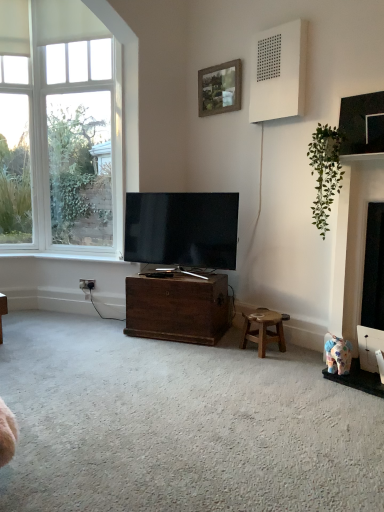
What is the approximate width of dark brown wood chest at center?

21.63 inches.

Describe the element at coordinates (338, 355) in the screenshot. I see `fluffy fabric elephant at lower right` at that location.

This screenshot has height=512, width=384. Identify the location of wooden frame at upper center. (219, 88).

Where is `clear glass window at left`? This screenshot has height=512, width=384. clear glass window at left is located at coordinates (66, 128).

Locate an element on the screen. The image size is (384, 512). dark brown wood chest at center is located at coordinates (178, 308).

The height and width of the screenshot is (512, 384). I want to click on toy above the wooden stool at lower right (from a real-world perspective), so click(338, 355).

Can you see fluffy fabric elephant at lower right touching wooden stool at lower right?

No.

Who is shorter, fluffy fabric elephant at lower right or wooden stool at lower right?

Standing shorter between the two is fluffy fabric elephant at lower right.

From the image's perspective, is fluffy fabric elephant at lower right located above or below wooden stool at lower right?

fluffy fabric elephant at lower right is situated lower than wooden stool at lower right in the image.

From the image's perspective, which one is positioned lower, wooden stool at lower right or white plastic power outlet at lower left?

wooden stool at lower right is shown below in the image.

Does wooden stool at lower right lie in front of white plastic power outlet at lower left?

Yes, the depth of wooden stool at lower right is less than that of white plastic power outlet at lower left.

Is wooden stool at lower right inside or outside of white plastic power outlet at lower left?

wooden stool at lower right is outside white plastic power outlet at lower left.

Considering the sizes of objects wooden stool at lower right and white plastic power outlet at lower left in the image provided, who is smaller, wooden stool at lower right or white plastic power outlet at lower left?

With smaller size is white plastic power outlet at lower left.

From the image's perspective, is white painted wood at lower left on top of white plastic power outlet at lower left?

Correct, white painted wood at lower left appears higher than white plastic power outlet at lower left in the image.

Identify the location of power outlet below the white painted wood at lower left (from a real-world perspective). This screenshot has height=512, width=384. (86, 284).

From a real-world perspective, does white painted wood at lower left sit lower than white plastic power outlet at lower left?

No, from a real-world perspective, white painted wood at lower left is not below white plastic power outlet at lower left.

Considering the points (22, 251) and (82, 287), which point is behind, point (22, 251) or point (82, 287)?

The point (22, 251) is farther.

Is fluffy fabric elephant at lower right looking in the opposite direction of white plastic power outlet at lower left?

No.

Would you say fluffy fabric elephant at lower right is a long distance from white plastic power outlet at lower left?

fluffy fabric elephant at lower right is positioned a significant distance from white plastic power outlet at lower left.

Is fluffy fabric elephant at lower right bigger than white plastic power outlet at lower left?

Yes.

Find the location of `power outlet located above the fluffy fabric elephant at lower right (from the image's perspective)`. power outlet located above the fluffy fabric elephant at lower right (from the image's perspective) is located at coordinates (86, 284).

Are wooden frame at upper center and dark brown wood chest at center beside each other?

No, wooden frame at upper center is not next to dark brown wood chest at center.

This screenshot has width=384, height=512. I want to click on picture frame that appears above the dark brown wood chest at center (from a real-world perspective), so click(219, 88).

Is wooden frame at upper center oriented away from dark brown wood chest at center?

wooden frame at upper center is not turned away from dark brown wood chest at center.

Based on the photo, is green leafy plant at upper right bigger than dark brown wood chest at center?

Incorrect, green leafy plant at upper right is not larger than dark brown wood chest at center.

Is green leafy plant at upper right at the left side of dark brown wood chest at center?

In fact, green leafy plant at upper right is to the right of dark brown wood chest at center.

Is green leafy plant at upper right far from dark brown wood chest at center?

That's right, there is a large distance between green leafy plant at upper right and dark brown wood chest at center.

Is green leafy plant at upper right inside the boundaries of dark brown wood chest at center, or outside?

The correct answer is: outside.

Which of these two, green leafy plant at upper right or fluffy fabric elephant at lower right, is smaller?

fluffy fabric elephant at lower right is smaller.

Considering the sizes of objects green leafy plant at upper right and fluffy fabric elephant at lower right in the image provided, who is wider, green leafy plant at upper right or fluffy fabric elephant at lower right?

green leafy plant at upper right is wider.

From a real-world perspective, is green leafy plant at upper right under fluffy fabric elephant at lower right?

Incorrect, from a real-world perspective, green leafy plant at upper right is higher than fluffy fabric elephant at lower right.

Find the location of a particular element. The image size is (384, 512). houseplant above the fluffy fabric elephant at lower right (from a real-world perspective) is located at coordinates (325, 172).

What are the coordinates of `toy in front of the wooden stool at lower right` in the screenshot? It's located at (338, 355).

Find the location of a particular element. The image size is (384, 512). stool on the right of white plastic power outlet at lower left is located at coordinates (263, 330).

Estimate the real-world distances between objects in this image. Which object is closer to fluffy fabric elephant at lower right, matte black tv at center or wooden frame at upper center?

Among the two, matte black tv at center is located nearer to fluffy fabric elephant at lower right.

When comparing their distances from white painted wood at lower left, does clear glass window at left or white plastic power outlet at lower left seem closer?

white plastic power outlet at lower left.

From the image, which object appears to be farther from wooden frame at upper center, fluffy fabric elephant at lower right or white painted wood at lower left?

fluffy fabric elephant at lower right.

From the image, which object appears to be nearer to fluffy fabric elephant at lower right, white matte speaker at upper right or clear glass window at left?

white matte speaker at upper right lies closer to fluffy fabric elephant at lower right than the other object.

Estimate the real-world distances between objects in this image. Which object is closer to dark brown wood chest at center, white painted wood at lower left or matte black tv at center?

The object closer to dark brown wood chest at center is matte black tv at center.

Estimate the real-world distances between objects in this image. Which object is further from dark brown wood chest at center, green leafy plant at upper right or matte black tv at center?

green leafy plant at upper right is further to dark brown wood chest at center.

Based on the photo, looking at the image, which one is located further to matte black tv at center, white painted wood at lower left or dark brown wood chest at center?

white painted wood at lower left lies further to matte black tv at center than the other object.

Looking at the image, which one is located further to white painted wood at lower left, white matte speaker at upper right or wooden stool at lower right?

white matte speaker at upper right lies further to white painted wood at lower left than the other object.

This screenshot has height=512, width=384. I want to click on power outlet between clear glass window at left and green leafy plant at upper right from left to right, so click(86, 284).

Identify the location of power outlet between white painted wood at lower left and dark brown wood chest at center from left to right. (86, 284).

In order to click on speaker between wooden frame at upper center and white plastic power outlet at lower left in the vertical direction in this screenshot , I will do `click(279, 73)`.

At what (x,y) coordinates should I click in order to perform the action: click on cabinetry located between white plastic power outlet at lower left and wooden stool at lower right in the left-right direction. Please return your answer as a coordinate pair (x, y). The height and width of the screenshot is (512, 384). Looking at the image, I should click on (178, 308).